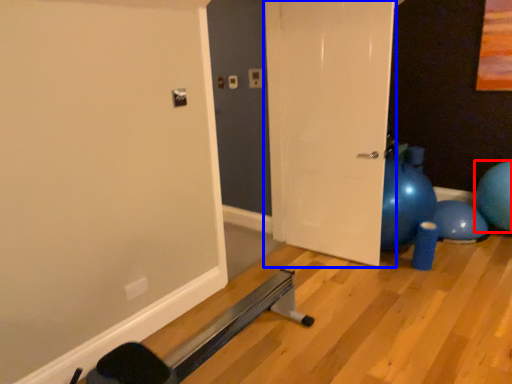
Question: Which object appears farthest to the camera in this image, ball (highlighted by a red box) or door (highlighted by a blue box)?

Choices:
 (A) ball
 (B) door

Answer: (A)